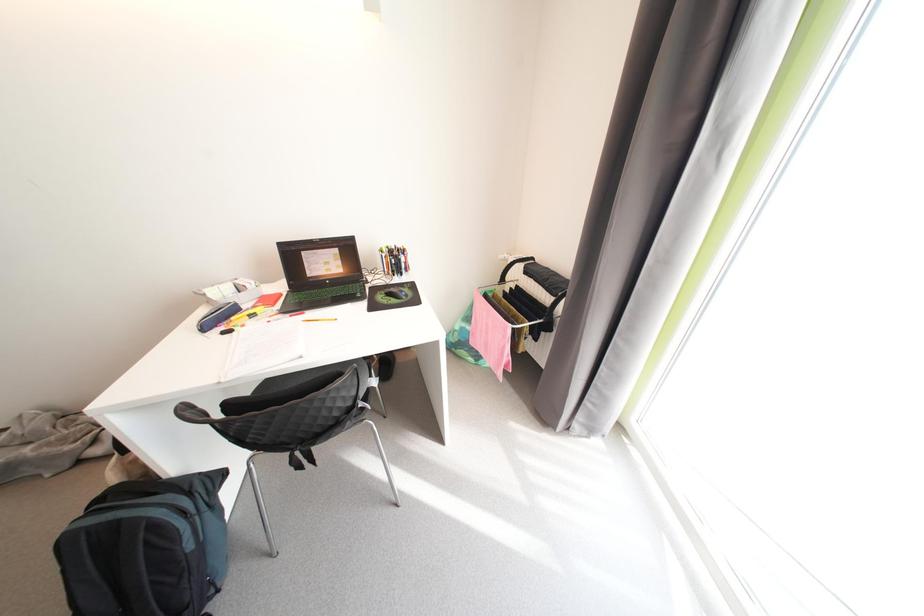
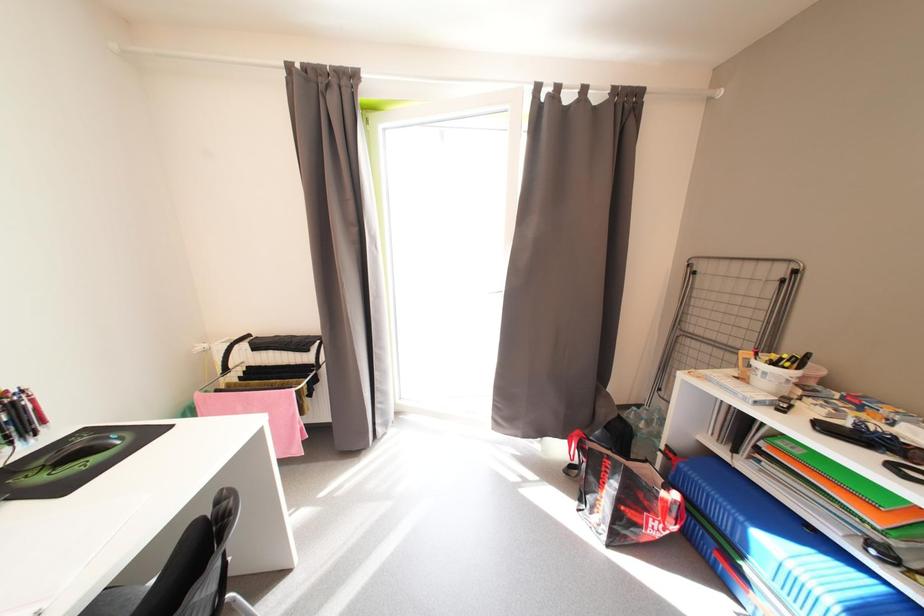
Question: The images are taken continuously from a first-person perspective. In which direction is your viewpoint rotating?

Choices:
 (A) Left
 (B) Right
 (C) Up
 (D) Down

Answer: (B)